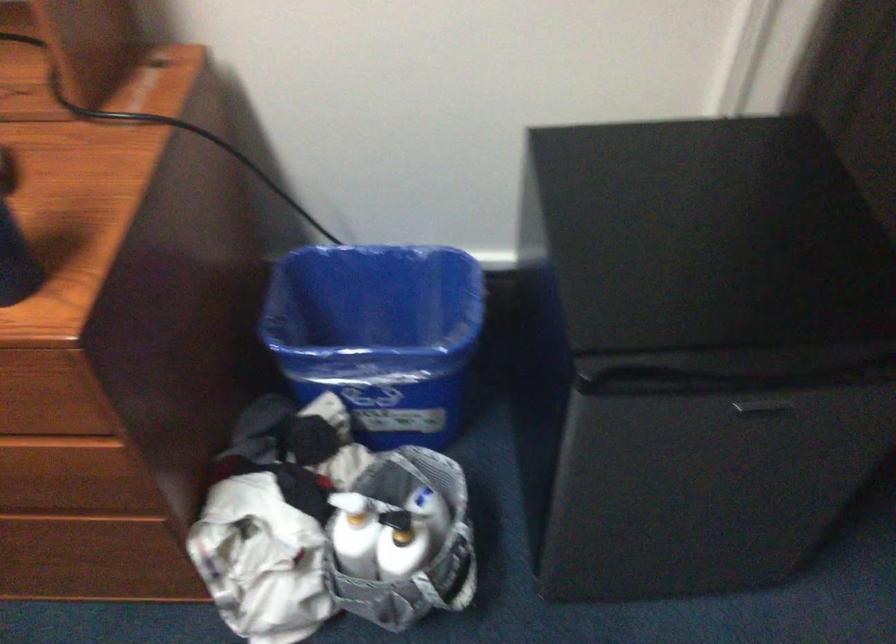
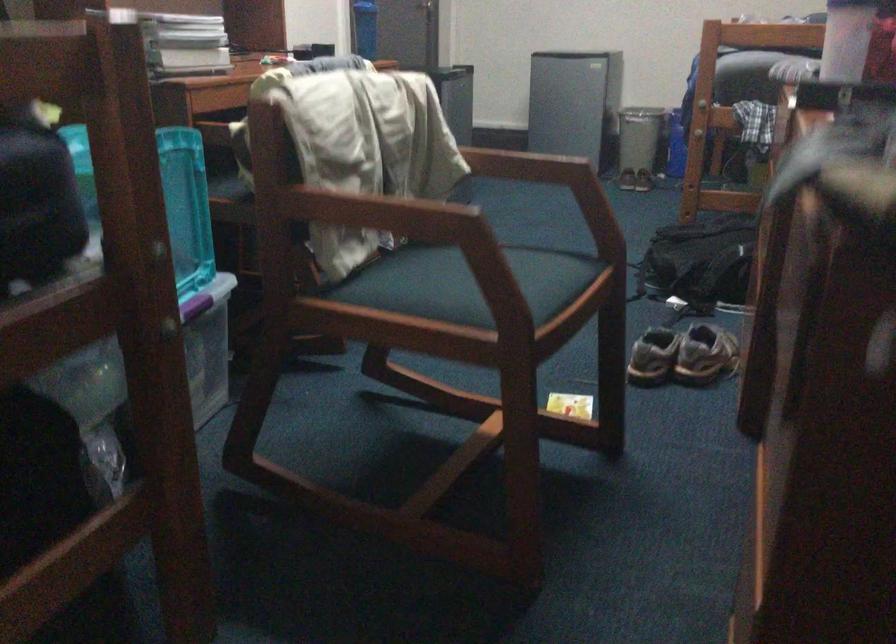
Question: I am providing you with two images of the same scene from different viewpoints. After the viewpoint changes to image2, which objects are now occluded?

Choices:
 (A) pair of brown shoes
 (B) drawer handle
 (C) chair sitting surface
 (D) dryer door handle

Answer: (B)